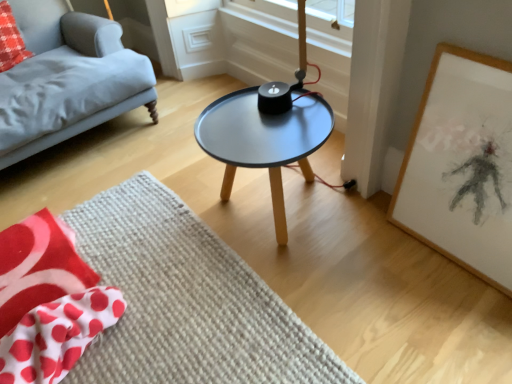
Identify the location of free space above matte black table at center (from a real-world perspective). The image size is (512, 384). (261, 135).